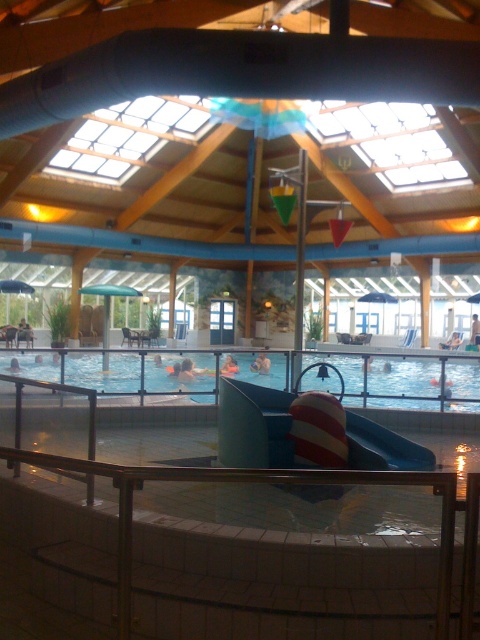
You are a lifeguard who needs to place a new floating device in the pool. The floating device requires at least 1.5 meters of water depth to be safely used. Given the clear plastic pool at center and the orange rubber ring at center, can you determine if the pool is deep enough?

The clear plastic pool at center has a greater height compared to orange rubber ring at center. Since the orange rubber ring at center floats on the water surface, the pool depth must be at least as tall as the ring. If the pool is taller than the ring, it likely meets the 1.5m requirement. However, without exact measurements, we can infer the pool is deeper than the ring but cannot confirm it meets the 1.5m requirement without more data.

You are standing at the entrance of the indoor swimming pool area. You want to locate the clear plastic pool at center. Based on the coordinates provided, where should you look in the image?

The clear plastic pool at center is located at the coordinates point (404, 381) in the image.

You are a lifeguard standing at the edge of the clear plastic pool at center. You see an orange rubber ring at center floating in the water. If you want to retrieve the ring without entering the pool, can you reach it from where you are standing?

The clear plastic pool at center might be wider than orange rubber ring at center, so it is uncertain whether the ring is within reach from the edge. The lifeguard should check the distance before attempting to retrieve it.